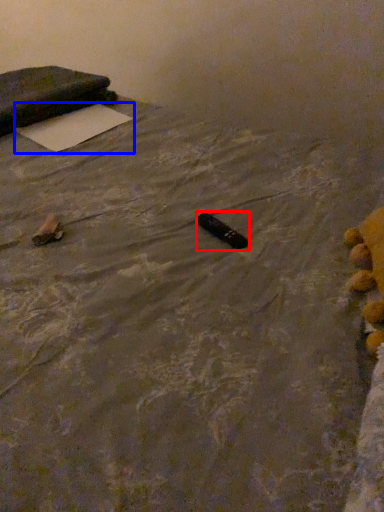
Question: Which object is further to the camera taking this photo, waste (highlighted by a red box) or yoga mat (highlighted by a blue box)?

Choices:
 (A) waste
 (B) yoga mat

Answer: (B)